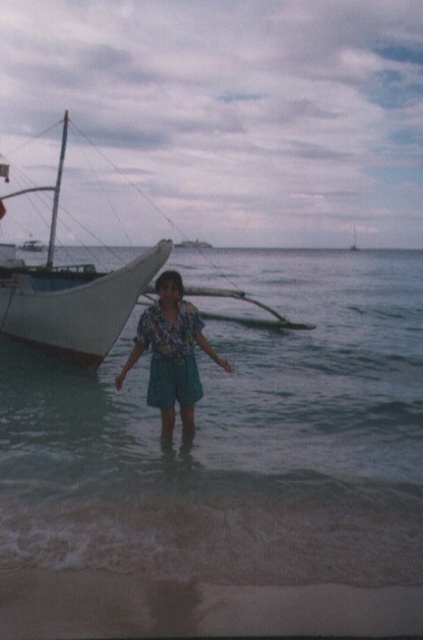
You are a photographer trying to capture a photo of the person standing in the water. Based on the scene, can you tell if the floral fabric shirt at center is visible through the clear water at center?

The clear water at center is positioned over floral fabric shirt at center, so the floral fabric shirt at center is visible through the clear water at center.

You are a photographer planning to capture a sunset shot from the beach. You have two objects in your frame, the clear water at center and the white matte boat at left. Which object will appear closer to the horizon line?

The clear water at center will appear closer to the horizon line because it is shorter than the white matte boat at left, meaning it is positioned further away in the scene.